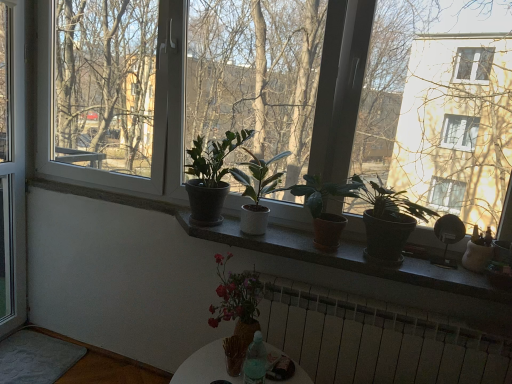
What is the approximate height of brown terracotta pot at center, positioned as the 4th houseplant in left-to-right order?

brown terracotta pot at center, positioned as the 4th houseplant in left-to-right order, is 13.28 inches in height.

The image size is (512, 384). Identify the location of soft gray carpet at lower left. coord(36,358).

Locate an element on the screen. matte black pot at center, which ranks as the 5th houseplant in left-to-right order is located at coordinates (388, 221).

The image size is (512, 384). I want to click on white metallic radiator at lower center, so [x=376, y=340].

Find the location of a particular element. The width and height of the screenshot is (512, 384). pink matte vase at center, positioned as the 4th houseplant in right-to-left order is located at coordinates (237, 310).

From the image's perspective, is matte black pot at center, positioned as the first houseplant in left-to-right order, above transparent glass window at left?

No, from the image's perspective, matte black pot at center, positioned as the first houseplant in left-to-right order, is not above transparent glass window at left.

Measure the distance from matte black pot at center, which ranks as the fifth houseplant in right-to-left order, to transparent glass window at left.

matte black pot at center, which ranks as the fifth houseplant in right-to-left order, is 1.15 meters from transparent glass window at left.

Identify the location of houseplant that is the 4th one above the transparent glass window at left (from a real-world perspective). (210, 177).

How many degrees apart are the facing directions of matte black pot at center, positioned as the first houseplant in left-to-right order, and transparent glass window at left?

The facing directions of matte black pot at center, positioned as the first houseplant in left-to-right order, and transparent glass window at left are 90.9 degrees apart.

Where is `window lying above the matte concrete window sill at center (from the image's perspective)`? The height and width of the screenshot is (384, 512). window lying above the matte concrete window sill at center (from the image's perspective) is located at coordinates (12, 167).

Looking at this image, is transparent glass window at left oriented towards matte concrete window sill at center?

Yes, transparent glass window at left faces towards matte concrete window sill at center.

Would you consider transparent glass window at left to be distant from matte concrete window sill at center?

Yes.

From the image's perspective, which is above, transparent glass window at left or matte concrete window sill at center?

transparent glass window at left is shown above in the image.

Measure the distance between matte white pot at center, the 3th houseplant from the left, and matte black pot at center, the 1th houseplant viewed from the right.

matte white pot at center, the 3th houseplant from the left, and matte black pot at center, the 1th houseplant viewed from the right, are 17.74 inches apart from each other.

Would you consider matte white pot at center, which is counted as the 3th houseplant, starting from the right, to be distant from matte black pot at center, the 1th houseplant viewed from the right?

matte white pot at center, which is counted as the 3th houseplant, starting from the right, is actually quite close to matte black pot at center, the 1th houseplant viewed from the right.

From a real-world perspective, is matte white pot at center, which is counted as the 3th houseplant, starting from the right, over matte black pot at center, which ranks as the 5th houseplant in left-to-right order?

Yes.

How many degrees apart are the facing directions of matte white pot at center, which is counted as the 3th houseplant, starting from the right, and matte black pot at center, which ranks as the 5th houseplant in left-to-right order?

The facing directions of matte white pot at center, which is counted as the 3th houseplant, starting from the right, and matte black pot at center, which ranks as the 5th houseplant in left-to-right order, are 0.00263 degrees apart.

Looking at this image, from a real-world perspective, is matte black pot at center, positioned as the first houseplant in left-to-right order, positioned over matte white pot at center, the 3th houseplant from the left, based on gravity?

Yes.

Does matte black pot at center, which ranks as the fifth houseplant in right-to-left order, have a lesser height compared to matte white pot at center, which is counted as the 3th houseplant, starting from the right?

No, matte black pot at center, which ranks as the fifth houseplant in right-to-left order, is not shorter than matte white pot at center, which is counted as the 3th houseplant, starting from the right.

Is matte black pot at center, which ranks as the fifth houseplant in right-to-left order, at the left side of matte white pot at center, which is counted as the 3th houseplant, starting from the right?

Yes, matte black pot at center, which ranks as the fifth houseplant in right-to-left order, is to the left of matte white pot at center, which is counted as the 3th houseplant, starting from the right.

Consider the image. Are transparent glass window at left and matte black pot at center, which ranks as the fifth houseplant in right-to-left order, located far from each other?

transparent glass window at left is positioned a significant distance from matte black pot at center, which ranks as the fifth houseplant in right-to-left order.

Which is correct: transparent glass window at left is inside matte black pot at center, which ranks as the fifth houseplant in right-to-left order, or outside of it?

The correct answer is: outside.

Between transparent glass window at left and matte black pot at center, positioned as the first houseplant in left-to-right order, which one has less height?

matte black pot at center, positioned as the first houseplant in left-to-right order.

From a real-world perspective, is transparent glass window at left located beneath matte black pot at center, which ranks as the fifth houseplant in right-to-left order?

Indeed, from a real-world perspective, transparent glass window at left is positioned beneath matte black pot at center, which ranks as the fifth houseplant in right-to-left order.

Which of these two, brown terracotta pot at center, positioned as the 4th houseplant in left-to-right order, or matte white pot at center, the 3th houseplant from the left, stands shorter?

Standing shorter between the two is brown terracotta pot at center, positioned as the 4th houseplant in left-to-right order.

Based on the photo, which is correct: brown terracotta pot at center, the 2th houseplant positioned from the right, is inside matte white pot at center, the 3th houseplant from the left, or outside of it?

brown terracotta pot at center, the 2th houseplant positioned from the right, is spatially situated outside matte white pot at center, the 3th houseplant from the left.

From the image's perspective, is brown terracotta pot at center, the 2th houseplant positioned from the right, above or below matte white pot at center, which is counted as the 3th houseplant, starting from the right?

brown terracotta pot at center, the 2th houseplant positioned from the right, is situated lower than matte white pot at center, which is counted as the 3th houseplant, starting from the right, in the image.

How different are the orientations of brown terracotta pot at center, positioned as the 4th houseplant in left-to-right order, and matte white pot at center, which is counted as the 3th houseplant, starting from the right, in degrees?

There is a 6.28e-05-degree angle between the facing directions of brown terracotta pot at center, positioned as the 4th houseplant in left-to-right order, and matte white pot at center, which is counted as the 3th houseplant, starting from the right.

Based on the photo, is matte black pot at center, which ranks as the 5th houseplant in left-to-right order, wider or thinner than soft gray carpet at lower left?

matte black pot at center, which ranks as the 5th houseplant in left-to-right order, is thinner than soft gray carpet at lower left.

Which is in front, matte black pot at center, which ranks as the 5th houseplant in left-to-right order, or soft gray carpet at lower left?

matte black pot at center, which ranks as the 5th houseplant in left-to-right order, is in front.

From their relative heights in the image, would you say matte black pot at center, which ranks as the 5th houseplant in left-to-right order, is taller or shorter than soft gray carpet at lower left?

In the image, matte black pot at center, which ranks as the 5th houseplant in left-to-right order, appears to be taller than soft gray carpet at lower left.

How different are the orientations of matte black pot at center, the 1th houseplant viewed from the right, and soft gray carpet at lower left in degrees?

matte black pot at center, the 1th houseplant viewed from the right, and soft gray carpet at lower left are facing 91 degrees away from each other.

You are a GUI agent. You are given a task and a screenshot of the screen. Output one action in this format:
    pyautogui.click(x=<x>, y=<y>)
    Task: Click on the window on the left of matte black pot at center, positioned as the first houseplant in left-to-right order
    This screenshot has width=512, height=384.
    Given the screenshot: What is the action you would take?
    coord(12,167)

This screenshot has width=512, height=384. I want to click on window sill below the transparent glass window at left (from the image's perspective), so click(x=348, y=258).

Estimate the real-world distances between objects in this image. Which object is closer to pink matte vase at center, the 2th houseplant when ordered from left to right, matte black pot at center, which ranks as the fifth houseplant in right-to-left order, or brown terracotta pot at center, the 2th houseplant positioned from the right?

The object closer to pink matte vase at center, the 2th houseplant when ordered from left to right, is matte black pot at center, which ranks as the fifth houseplant in right-to-left order.

Estimate the real-world distances between objects in this image. Which object is further from translucent glass vase at lower center, matte black pot at center, which ranks as the fifth houseplant in right-to-left order, or white metallic radiator at lower center?

matte black pot at center, which ranks as the fifth houseplant in right-to-left order, is further to translucent glass vase at lower center.

Based on their spatial positions, is soft gray carpet at lower left or matte black pot at center, the 1th houseplant viewed from the right, closer to white metallic radiator at lower center?

matte black pot at center, the 1th houseplant viewed from the right, is positioned closer to the anchor white metallic radiator at lower center.

Looking at the image, which one is located further to pink matte vase at center, the 2th houseplant when ordered from left to right, white metallic radiator at lower center or matte black pot at center, which ranks as the fifth houseplant in right-to-left order?

white metallic radiator at lower center is positioned further to the anchor pink matte vase at center, the 2th houseplant when ordered from left to right.

When comparing their distances from soft gray carpet at lower left, does matte black pot at center, positioned as the first houseplant in left-to-right order, or white metallic radiator at lower center seem further?

white metallic radiator at lower center is further to soft gray carpet at lower left.

Looking at this image, when comparing their distances from translucent glass vase at lower center, does white metallic radiator at lower center or matte white pot at center, the 3th houseplant from the left, seem further?

matte white pot at center, the 3th houseplant from the left.

When comparing their distances from brown terracotta pot at center, positioned as the 4th houseplant in left-to-right order, does matte black pot at center, which ranks as the fifth houseplant in right-to-left order, or matte black pot at center, the 1th houseplant viewed from the right, seem closer?

matte black pot at center, the 1th houseplant viewed from the right, lies closer to brown terracotta pot at center, positioned as the 4th houseplant in left-to-right order, than the other object.

Looking at the image, which one is located further to white metallic radiator at lower center, soft gray carpet at lower left or pink matte vase at center, positioned as the 4th houseplant in right-to-left order?

Based on the image, soft gray carpet at lower left appears to be further to white metallic radiator at lower center.

The height and width of the screenshot is (384, 512). In order to click on plain located between transparent glass window at left and white metallic radiator at lower center in the left-right direction in this screenshot , I will do `click(36, 358)`.

The height and width of the screenshot is (384, 512). Find the location of `window sill that lies between brown terracotta pot at center, positioned as the 4th houseplant in left-to-right order, and translucent glass vase at lower center from top to bottom`. window sill that lies between brown terracotta pot at center, positioned as the 4th houseplant in left-to-right order, and translucent glass vase at lower center from top to bottom is located at coordinates (348, 258).

The image size is (512, 384). Find the location of `window sill that lies between matte black pot at center, which ranks as the fifth houseplant in right-to-left order, and white metallic radiator at lower center from top to bottom`. window sill that lies between matte black pot at center, which ranks as the fifth houseplant in right-to-left order, and white metallic radiator at lower center from top to bottom is located at coordinates (348, 258).

The height and width of the screenshot is (384, 512). In order to click on radiator between soft gray carpet at lower left and matte black pot at center, the 1th houseplant viewed from the right, in the horizontal direction in this screenshot , I will do `click(376, 340)`.